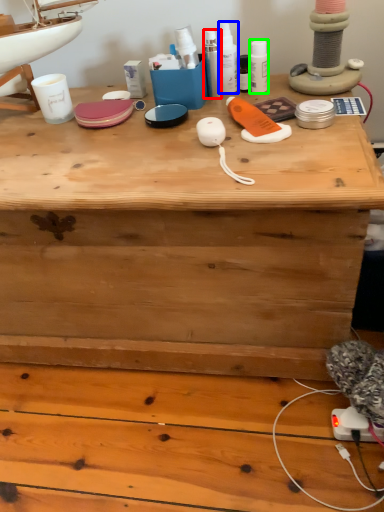
Question: Based on their relative distances, which object is nearer to toiletry (highlighted by a red box)? Choose from toiletry (highlighted by a blue box) and toiletry (highlighted by a green box).

Choices:
 (A) toiletry
 (B) toiletry

Answer: (A)